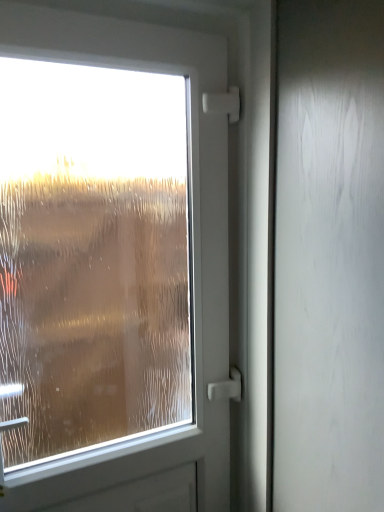
This screenshot has width=384, height=512. What do you see at coordinates (91, 255) in the screenshot? I see `frosted glass window at left` at bounding box center [91, 255].

Where is `frosted glass window at left`? This screenshot has height=512, width=384. frosted glass window at left is located at coordinates (91, 255).

Measure the distance between frosted glass window at left and camera.

frosted glass window at left is 38.82 inches away from camera.

In order to face frosted glass window at left, should I rotate leftwards or rightwards?

Turn left by 9.846 degrees to look at frosted glass window at left.

Image resolution: width=384 pixels, height=512 pixels. Describe the element at coordinates (329, 257) in the screenshot. I see `satin white screen door at right` at that location.

Locate an element on the screen. satin white screen door at right is located at coordinates (329, 257).

The image size is (384, 512). I want to click on frosted glass window at left, so click(x=91, y=255).

Considering the positions of objects satin white screen door at right and frosted glass window at left in the image provided, who is more to the left, satin white screen door at right or frosted glass window at left?

From the viewer's perspective, frosted glass window at left appears more on the left side.

Who is more distant, satin white screen door at right or frosted glass window at left?

frosted glass window at left is behind.

Considering the points (305, 95) and (124, 163), which point is behind, point (305, 95) or point (124, 163)?

The point (124, 163) is farther from the camera.

From the image's perspective, who appears lower, satin white screen door at right or frosted glass window at left?

From the image's view, frosted glass window at left is below.

From a real-world perspective, is satin white screen door at right under frosted glass window at left?

Actually, satin white screen door at right is physically above frosted glass window at left in the real world.

Looking at their sizes, would you say satin white screen door at right is wider or thinner than frosted glass window at left?

Considering their sizes, satin white screen door at right looks broader than frosted glass window at left.

Considering the relative sizes of satin white screen door at right and frosted glass window at left in the image provided, is satin white screen door at right shorter than frosted glass window at left?

No, satin white screen door at right is not shorter than frosted glass window at left.

Which of these two, satin white screen door at right or frosted glass window at left, is smaller?

frosted glass window at left.

Do you think satin white screen door at right is within frosted glass window at left, or outside of it?

The correct answer is: outside.

Is satin white screen door at right next to frosted glass window at left?

satin white screen door at right is not next to frosted glass window at left, and they're not touching.

Is satin white screen door at right turned away from frosted glass window at left?

That's not correct — satin white screen door at right is not looking away from frosted glass window at left.

Can you tell me how much satin white screen door at right and frosted glass window at left differ in facing direction?

satin white screen door at right and frosted glass window at left are facing 0.105 degrees away from each other.

How much distance is there between satin white screen door at right and frosted glass window at left?

satin white screen door at right and frosted glass window at left are 3.57 feet apart.

You are a GUI agent. You are given a task and a screenshot of the screen. Output one action in this format:
    pyautogui.click(x=<x>, y=<y>)
    Task: Click on the screen door above the frosted glass window at left (from a real-world perspective)
    This screenshot has width=384, height=512.
    Given the screenshot: What is the action you would take?
    pyautogui.click(x=329, y=257)

Between frosted glass window at left and satin white screen door at right, which one appears on the left side from the viewer's perspective?

frosted glass window at left is more to the left.

Looking at this image, is frosted glass window at left further to the viewer compared to satin white screen door at right?

Yes.

Which point is more distant from viewer, (x=85, y=326) or (x=370, y=204)?

The point (x=85, y=326) is farther from the camera.

From the image's perspective, which is above, frosted glass window at left or satin white screen door at right?

From the image's view, satin white screen door at right is above.

From a real-world perspective, who is located higher, frosted glass window at left or satin white screen door at right?

satin white screen door at right.

Between frosted glass window at left and satin white screen door at right, which one has larger width?

Wider between the two is satin white screen door at right.

Does frosted glass window at left have a greater height compared to satin white screen door at right?

No.

Considering the sizes of frosted glass window at left and satin white screen door at right in the image, is frosted glass window at left bigger or smaller than satin white screen door at right?

Clearly, frosted glass window at left is smaller in size than satin white screen door at right.

Could satin white screen door at right be considered to be inside frosted glass window at left?

No, frosted glass window at left does not contain satin white screen door at right.

Is frosted glass window at left directly adjacent to satin white screen door at right?

No, frosted glass window at left is not with satin white screen door at right.

Is frosted glass window at left looking in the opposite direction of satin white screen door at right?

frosted glass window at left is not turned away from satin white screen door at right.

What's the angular difference between frosted glass window at left and satin white screen door at right's facing directions?

The angle between the facing direction of frosted glass window at left and the facing direction of satin white screen door at right is 0.105 degrees.

The height and width of the screenshot is (512, 384). I want to click on airplane window below the satin white screen door at right (from the image's perspective), so click(91, 255).

In order to click on screen door on the right of frosted glass window at left in this screenshot , I will do `click(329, 257)`.

In order to click on screen door above the frosted glass window at left (from a real-world perspective) in this screenshot , I will do `click(329, 257)`.